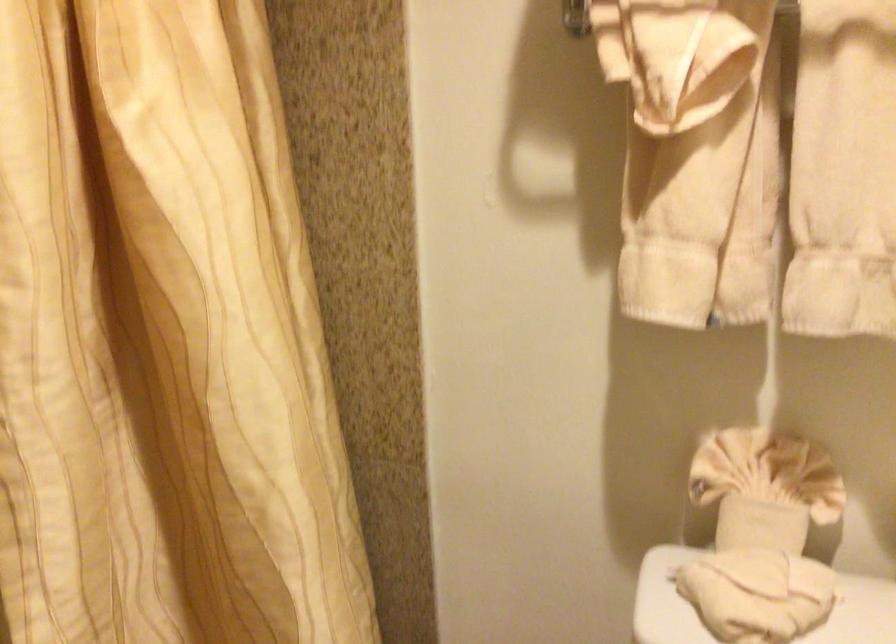
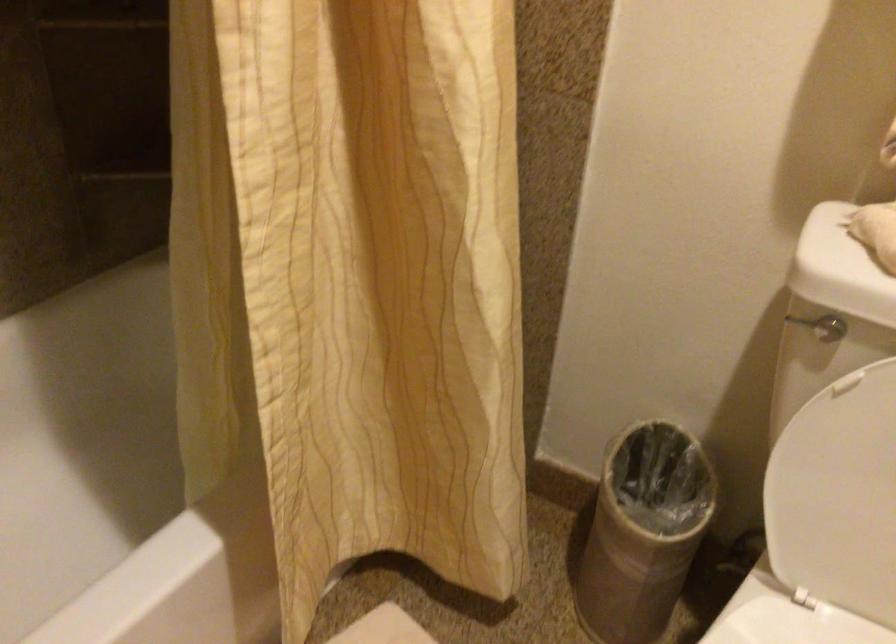
Question: What movement of the cameraman would produce the second image?

Choices:
 (A) Left
 (B) Right
 (C) Forward
 (D) Backward

Answer: (A)